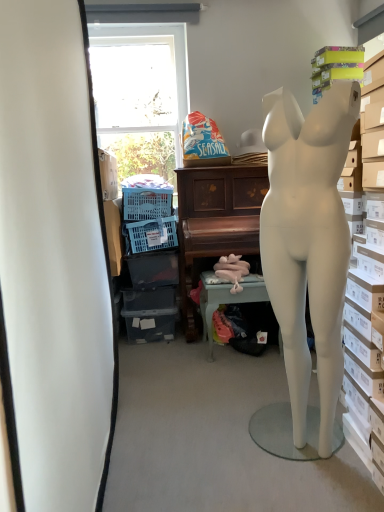
Image resolution: width=384 pixels, height=512 pixels. In order to click on vacant space underneath white matte mannequin at right (from a real-world perspective) in this screenshot , I will do pos(299,452).